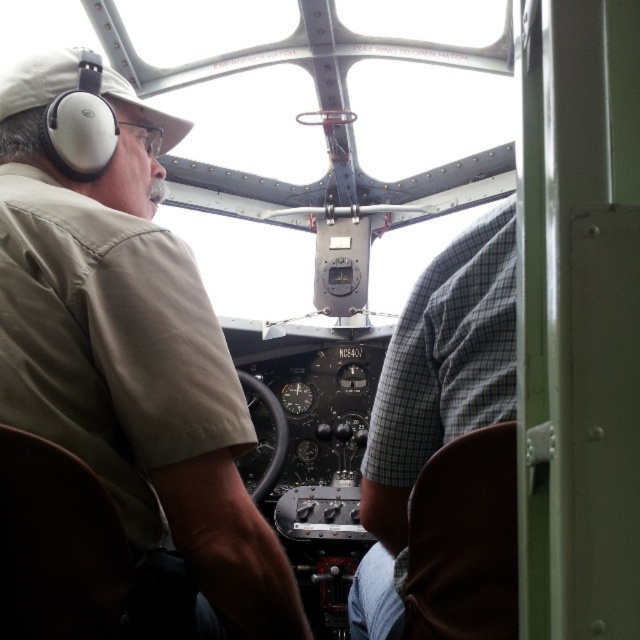
You are a pilot in the cockpit and need to reach both the point at the control panel at point (216, 556) and the point at the control panel at point (365, 476). Which point will you reach first if you extend your arm straight forward?

You will reach point (216, 556) first because it is closer to you than point (365, 476).

You are a flight attendant trying to fit a 12 inch wide first aid kit between the matte khaki shirt at left and the gray checkered shirt at center. Can you determine if there is enough space?

The matte khaki shirt at left might be wider than gray checkered shirt at center, so the space between them may be insufficient for the 12 inch wide first aid kit. Check the actual width before placing it.